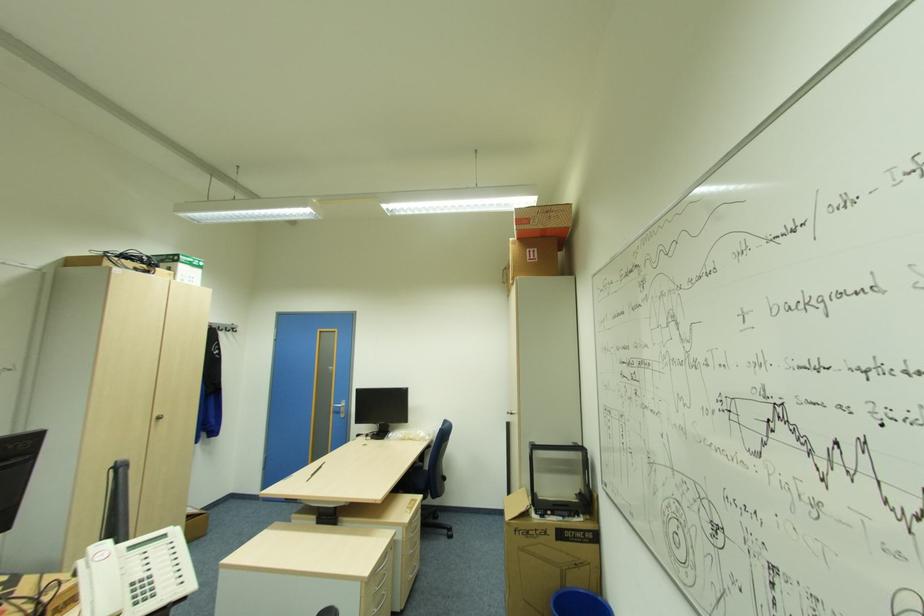
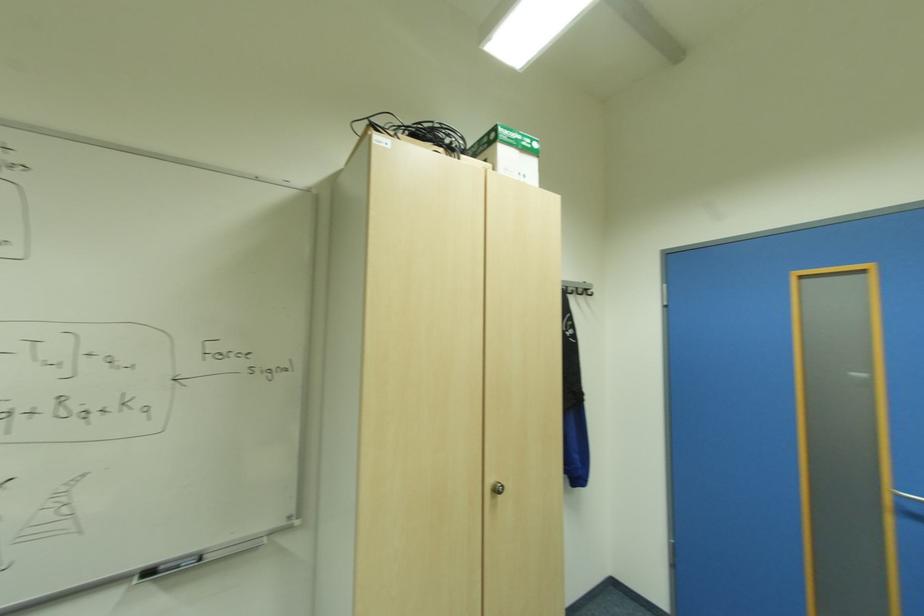
The point at (236, 329) is marked in the first image. Where is the corresponding point in the second image?

(588, 291)